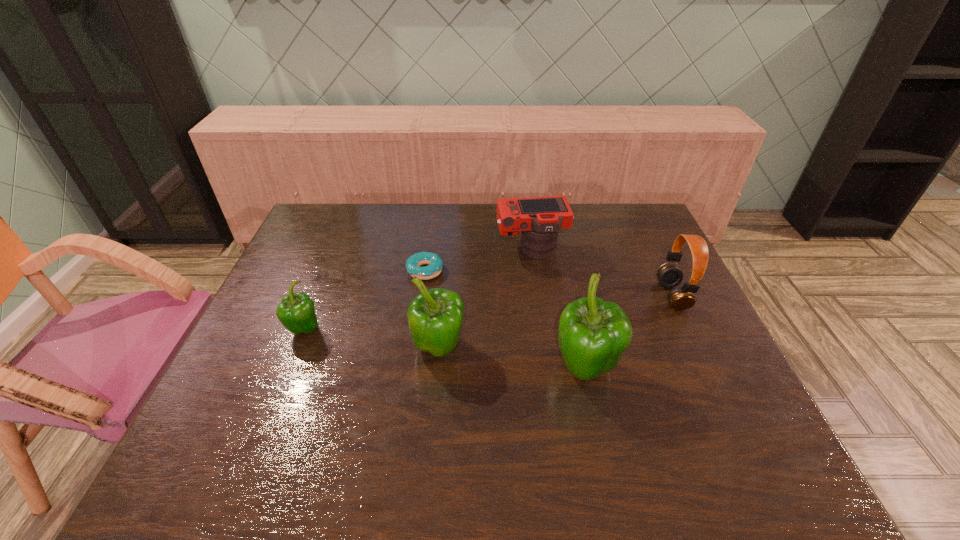
Find the location of `vacant space at the near edge of the desktop`. vacant space at the near edge of the desktop is located at coordinates (497, 411).

Locate an element on the screen. The height and width of the screenshot is (540, 960). vacant space at the left edge of the desktop is located at coordinates (286, 265).

Locate an element on the screen. The width and height of the screenshot is (960, 540). vacant space at the far left corner is located at coordinates (336, 226).

Find the location of `free space at the far right corner of the desktop`. free space at the far right corner of the desktop is located at coordinates (651, 224).

At what (x,y) coordinates should I click in order to perform the action: click on empty location between the shortest object and the shortest bell pepper. Please return your answer as a coordinate pair (x, y). The width and height of the screenshot is (960, 540). Looking at the image, I should click on (365, 300).

Locate an element on the screen. vacant space that's between the rightmost bell pepper and the doughnut is located at coordinates (505, 320).

Where is `free space between the second shortest bell pepper and the shortest bell pepper`? This screenshot has height=540, width=960. free space between the second shortest bell pepper and the shortest bell pepper is located at coordinates (372, 339).

Locate an element on the screen. free space that is in between the doughnut and the camera is located at coordinates (478, 260).

Identify the location of free point between the camera and the leftmost bell pepper. (419, 290).

This screenshot has height=540, width=960. I want to click on unoccupied position between the leftmost object and the doughnut, so click(365, 300).